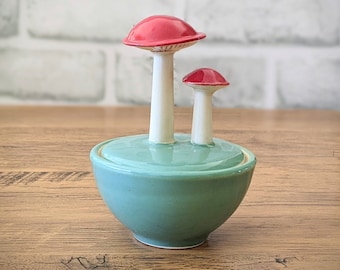
The height and width of the screenshot is (270, 340). I want to click on teal circled bowl top, so click(x=169, y=155).